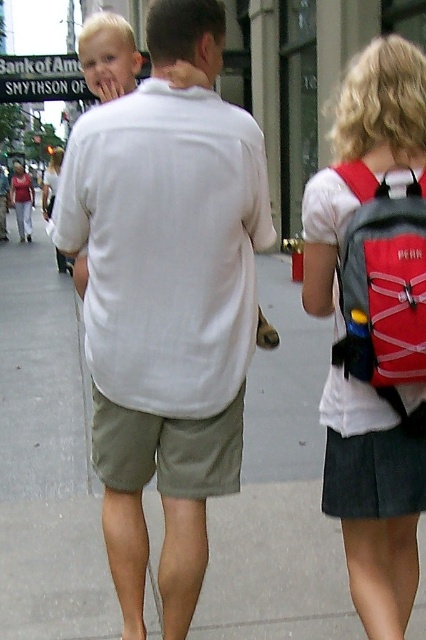
Question: Which is farther from the white cotton shirt at center?

Choices:
 (A) red fabric backpack at right
 (B) matte white shirt at upper left
 (C) gray concrete pavement at center

Answer: (B)

Question: In this image, where is khaki cotton shorts at center located relative to matte white shirt at upper left?

Choices:
 (A) right
 (B) left

Answer: (A)

Question: Which point is closer to the camera?

Choices:
 (A) (127, 426)
 (B) (365, 188)

Answer: (B)

Question: Is khaki cotton shorts at center positioned at the back of blonde hair at upper left?

Choices:
 (A) yes
 (B) no

Answer: (B)

Question: Considering the relative positions of white cotton shirt at center and matte white shirt at upper left in the image provided, where is white cotton shirt at center located with respect to matte white shirt at upper left?

Choices:
 (A) left
 (B) right

Answer: (B)

Question: Which object appears closest to the camera in this image?

Choices:
 (A) white cotton shirt at center
 (B) gray concrete pavement at center
 (C) red fabric backpack at right

Answer: (C)